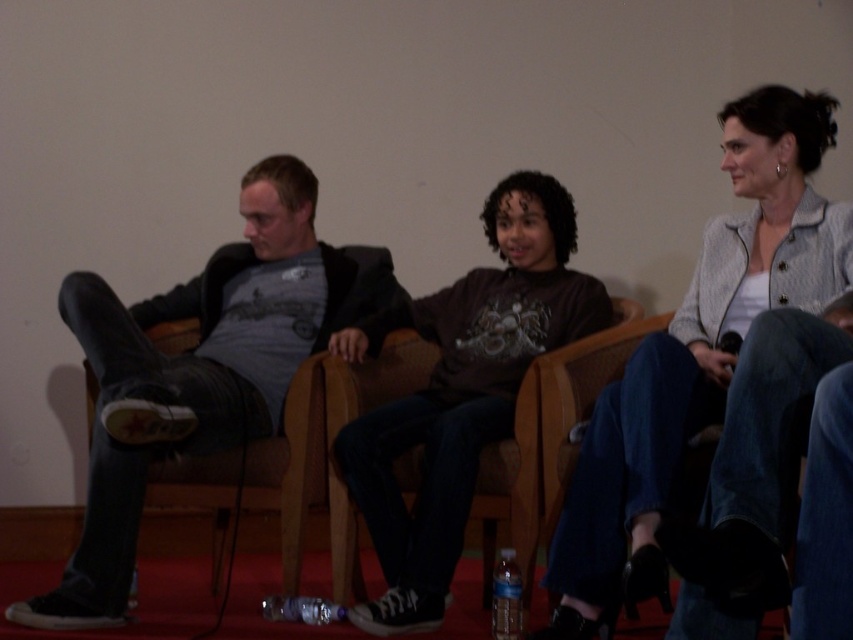
Question: Estimate the real-world distances between objects in this image. Which object is farther from the light gray textured blazer at upper right?

Choices:
 (A) matte gray sweater at center
 (B) matte gray t-shirt at left

Answer: (B)

Question: Can you confirm if light gray textured blazer at upper right is positioned above matte gray sweater at center?

Choices:
 (A) yes
 (B) no

Answer: (A)

Question: Among these objects, which one is nearest to the camera?

Choices:
 (A) matte gray sweater at center
 (B) matte gray t-shirt at left

Answer: (B)

Question: In this image, where is light gray textured blazer at upper right located relative to matte gray sweater at center?

Choices:
 (A) above
 (B) below

Answer: (A)

Question: Can you confirm if light gray textured blazer at upper right is smaller than matte gray sweater at center?

Choices:
 (A) yes
 (B) no

Answer: (A)

Question: Which object is positioned closest to the light gray textured blazer at upper right?

Choices:
 (A) matte gray t-shirt at left
 (B) matte gray sweater at center

Answer: (B)